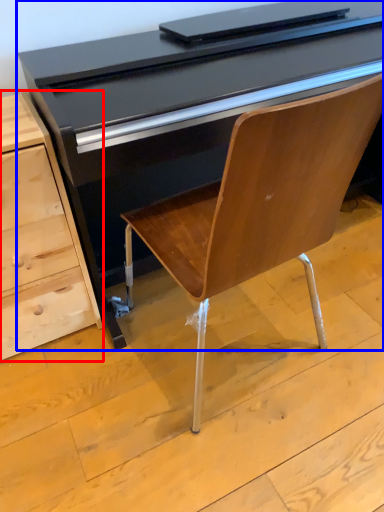
Question: Which of the following is the farthest to the observer, chest of drawers (highlighted by a red box) or desk (highlighted by a blue box)?

Choices:
 (A) chest of drawers
 (B) desk

Answer: (A)